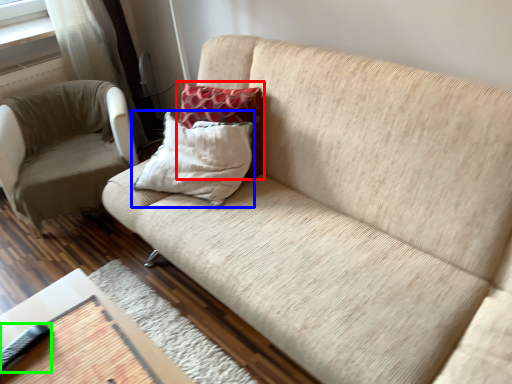
Question: Which object is the closest to the pillow (highlighted by a red box)? Choose among these: pillow (highlighted by a blue box) or remote (highlighted by a green box).

Choices:
 (A) pillow
 (B) remote

Answer: (A)